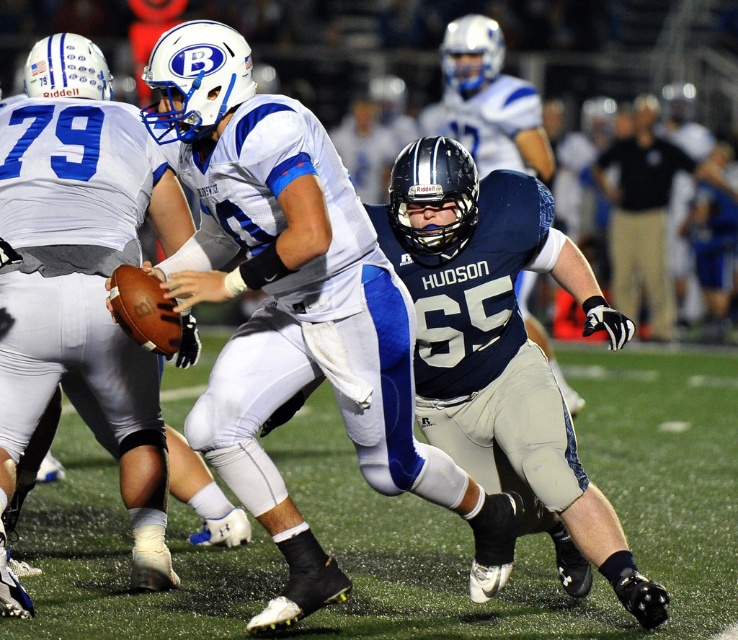
Question: Can you confirm if green turf at center is wider than dark blue jersey at center?

Choices:
 (A) no
 (B) yes

Answer: (A)

Question: Can you confirm if navy blue uniform at center is positioned below matte blue jersey at center?

Choices:
 (A) no
 (B) yes

Answer: (B)

Question: Which of the following is the closest to the observer?

Choices:
 (A) (579, 557)
 (B) (390, 516)
 (C) (537, 156)

Answer: (A)

Question: Which is nearer to the navy blue uniform at center?

Choices:
 (A) dark blue jersey at center
 (B) green turf at center
 (C) matte blue jersey at center

Answer: (C)

Question: Is green turf at center wider than dark blue jersey at center?

Choices:
 (A) no
 (B) yes

Answer: (A)

Question: Which of these objects is positioned closest to the dark blue jersey at center?

Choices:
 (A) matte blue jersey at center
 (B) navy blue uniform at center
 (C) green turf at center

Answer: (C)